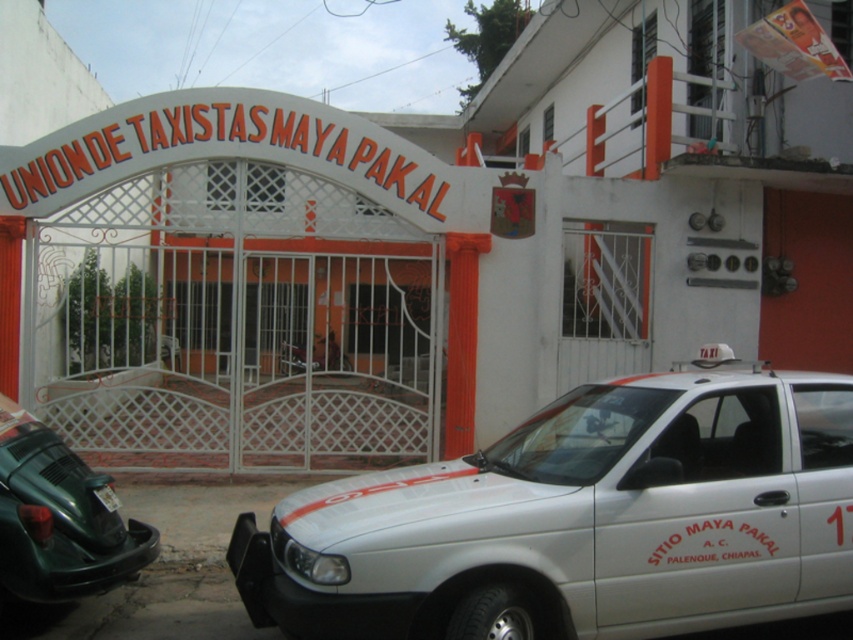
Question: Can you confirm if white glossy taxi at center is positioned to the right of black plastic license plate at lower left?

Choices:
 (A) yes
 (B) no

Answer: (A)

Question: Which is nearer to the white glossy taxi at center?

Choices:
 (A) black plastic license plate at lower left
 (B) green matte car at lower left

Answer: (B)

Question: Which of the following is the closest to the observer?

Choices:
 (A) white glossy taxi at center
 (B) black plastic license plate at lower left
 (C) green matte car at lower left

Answer: (A)

Question: Observing the image, what is the correct spatial positioning of green matte car at lower left in reference to black plastic license plate at lower left?

Choices:
 (A) below
 (B) above

Answer: (A)

Question: Among these points, which one is nearest to the camera?

Choices:
 (A) (310, 616)
 (B) (20, 545)

Answer: (A)

Question: Is green matte car at lower left thinner than black plastic license plate at lower left?

Choices:
 (A) no
 (B) yes

Answer: (A)